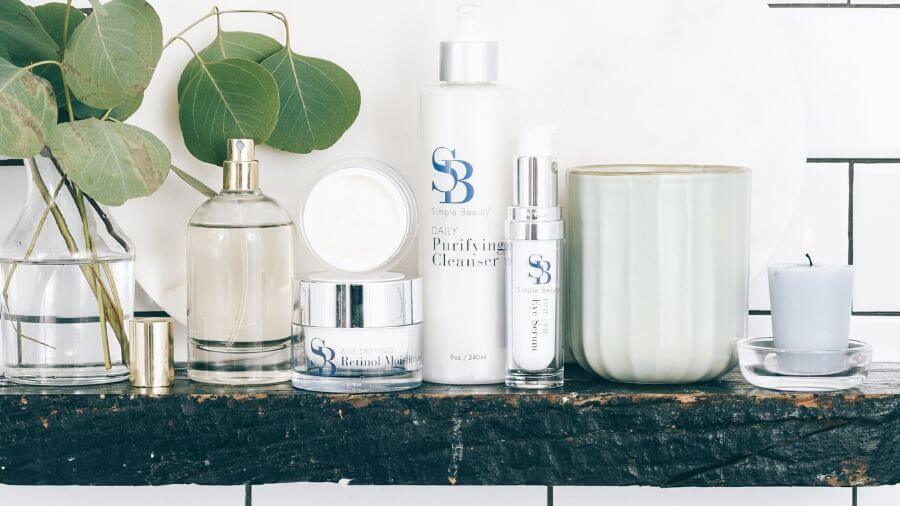
Identify the location of tile. (860, 113), (868, 193), (833, 207), (878, 489), (813, 495), (504, 496), (234, 499), (51, 340), (64, 290), (4, 191).